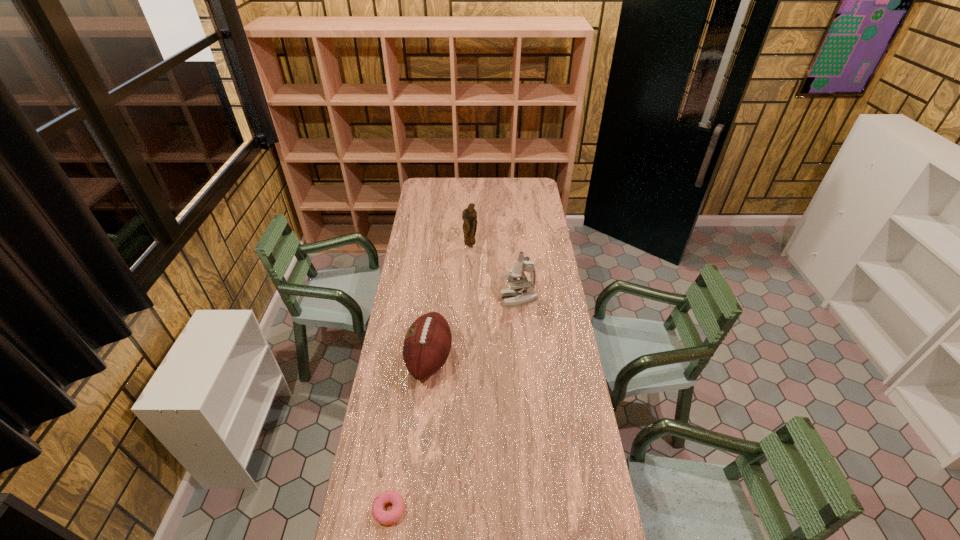
Identify the location of free spot between the microscope and the figurine. The width and height of the screenshot is (960, 540). (494, 273).

Locate an element on the screen. vacant area that lies between the nearest object and the second farthest object is located at coordinates (454, 404).

Find the location of `free space that is in between the second object from right to left and the second farthest object`. free space that is in between the second object from right to left and the second farthest object is located at coordinates (494, 273).

What are the coordinates of `blank region between the third nearest object and the third object from left to right` in the screenshot? It's located at (494, 273).

This screenshot has width=960, height=540. Identify the location of vacant space that's between the farthest object and the doughnut. (430, 378).

Where is `vacant space in between the rightmost object and the second object from right to left`? vacant space in between the rightmost object and the second object from right to left is located at coordinates (494, 273).

I want to click on vacant space in between the third tallest object and the microscope, so click(474, 329).

The width and height of the screenshot is (960, 540). I want to click on free point between the microscope and the shortest object, so click(454, 404).

The width and height of the screenshot is (960, 540). In order to click on vacant area between the rightmost object and the nearest object in this screenshot , I will do `click(454, 404)`.

Select which object appears as the closest to the doughnut. Please provide its 2D coordinates. Your answer should be formatted as a tuple, i.e. [(x, y)], where the tuple contains the x and y coordinates of a point satisfying the conditions above.

[(427, 343)]